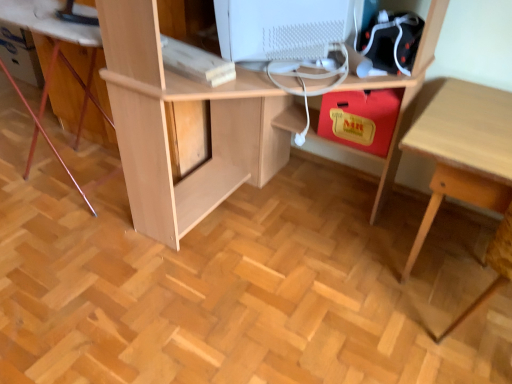
Locate an element on the screen. Image resolution: width=512 pixels, height=384 pixels. free space in front of light wood desk at center is located at coordinates (241, 328).